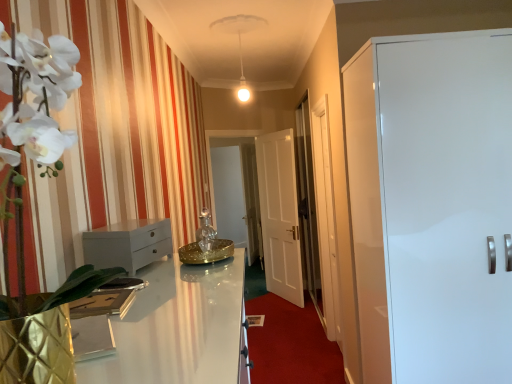
Question: In which direction should I rotate to look at transparent glass door at center, the 2th glass door when ordered from left to right?

Choices:
 (A) right
 (B) left

Answer: (A)

Question: Are gold metallic tray at center and white glossy chest of drawers at left located far from each other?

Choices:
 (A) yes
 (B) no

Answer: (A)

Question: Can you confirm if gold metallic tray at center is positioned to the right of white glossy chest of drawers at left?

Choices:
 (A) yes
 (B) no

Answer: (A)

Question: Could you tell me if gold metallic tray at center is turned towards white glossy chest of drawers at left?

Choices:
 (A) no
 (B) yes

Answer: (A)

Question: Is gold metallic tray at center outside white glossy chest of drawers at left?

Choices:
 (A) no
 (B) yes

Answer: (B)

Question: Is gold metallic tray at center surrounding white glossy chest of drawers at left?

Choices:
 (A) yes
 (B) no

Answer: (B)

Question: Is gold metallic tray at center bigger than white glossy chest of drawers at left?

Choices:
 (A) yes
 (B) no

Answer: (A)

Question: Does transparent glass door at center, which appears as the first glass door when viewed from the left, have a larger size compared to white glossy cabinet at right, the first door from the right?

Choices:
 (A) yes
 (B) no

Answer: (B)

Question: From a real-world perspective, is transparent glass door at center, the 1th glass door in the back-to-front sequence, physically below white glossy cabinet at right, placed as the second door when sorted from back to front?

Choices:
 (A) no
 (B) yes

Answer: (B)

Question: Does transparent glass door at center, positioned as the second glass door in right-to-left order, appear on the right side of white glossy cabinet at right, the first door from the right?

Choices:
 (A) no
 (B) yes

Answer: (A)

Question: From the image's perspective, is transparent glass door at center, which appears as the first glass door when viewed from the left, located above white glossy cabinet at right, the first door from the right?

Choices:
 (A) no
 (B) yes

Answer: (B)

Question: Is white glossy cabinet at right, the first door from the right, surrounded by transparent glass door at center, which appears as the first glass door when viewed from the left?

Choices:
 (A) yes
 (B) no

Answer: (B)

Question: Does white glossy door at center, the 1th door viewed from the back, turn towards white fabric curtain at left?

Choices:
 (A) yes
 (B) no

Answer: (B)